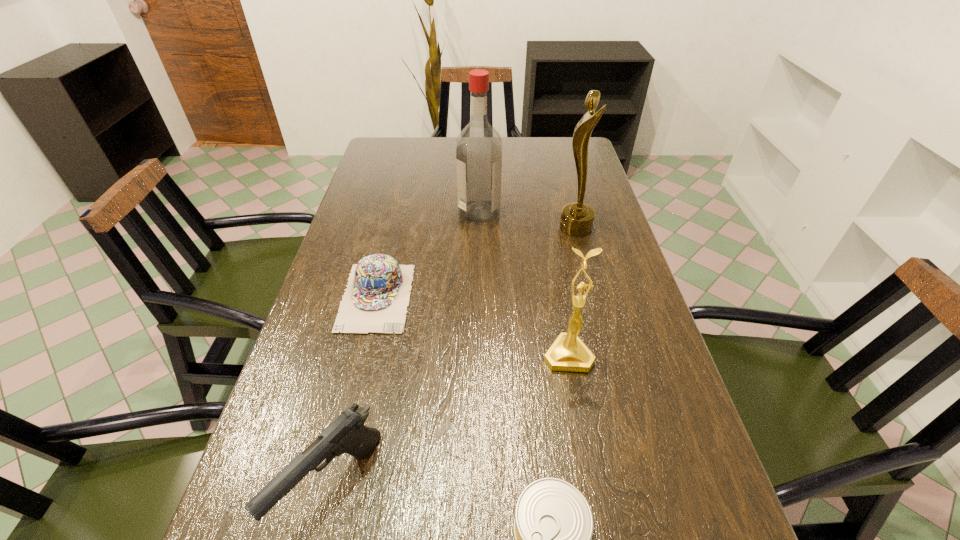
Where is `object that is the closest to the farther award`? object that is the closest to the farther award is located at coordinates (479, 147).

I want to click on vacant space that satisfies the following two spatial constraints: 1. on the front-facing side of the farther award; 2. on the front, side, and top of the fourth nearest object, so click(x=594, y=297).